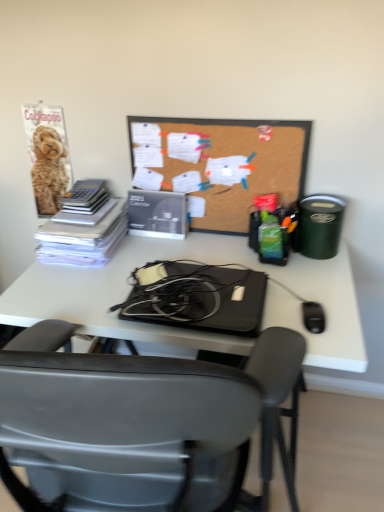
Find the location of a particular element. The width and height of the screenshot is (384, 512). vacant point to the left of black matte laptop at center is located at coordinates (87, 291).